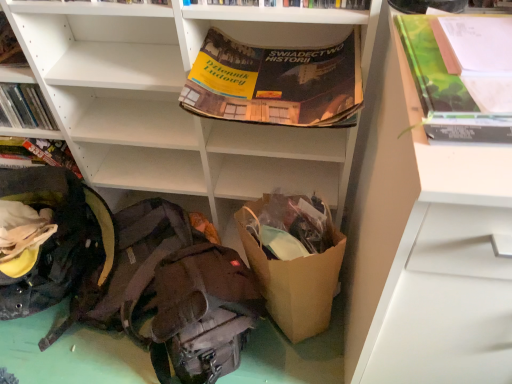
Question: In terms of width, does white matte shelf at upper center, which ranks as the second shelf in right-to-left order, look wider or thinner when compared to brown paper bag at lower center?

Choices:
 (A) thin
 (B) wide

Answer: (A)

Question: Relative to brown paper bag at lower center, is white matte shelf at upper center, which ranks as the second shelf in right-to-left order, in front or behind?

Choices:
 (A) behind
 (B) front

Answer: (B)

Question: Considering the real-world distances, which object is closest to the dark brown fabric backpack at lower left, the third backpack from the left?

Choices:
 (A) green matte book at upper right, which is counted as the 2th paperback book, starting from the left
 (B) white matte drawer at right, the 2th shelf in the left-to-right sequence
 (C) brown paper bag at lower center
 (D) dark gray fabric backpack at lower left, positioned as the 2th backpack in right-to-left order
 (E) dark gray fabric backpack at lower left, the 1th backpack from the left

Answer: (C)

Question: Based on their relative distances, which object is nearer to the dark gray fabric backpack at lower left, the 1th backpack from the left?

Choices:
 (A) dark brown fabric backpack at lower left, the 1th backpack when ordered from right to left
 (B) white matte drawer at right, the 2th shelf in the left-to-right sequence
 (C) white matte shelf at upper center, positioned as the 1th shelf in left-to-right order
 (D) green matte book at upper right, which is counted as the 2th paperback book, starting from the left
 (E) hardcover book at upper center, placed as the 2th book when sorted from bottom to top

Answer: (C)